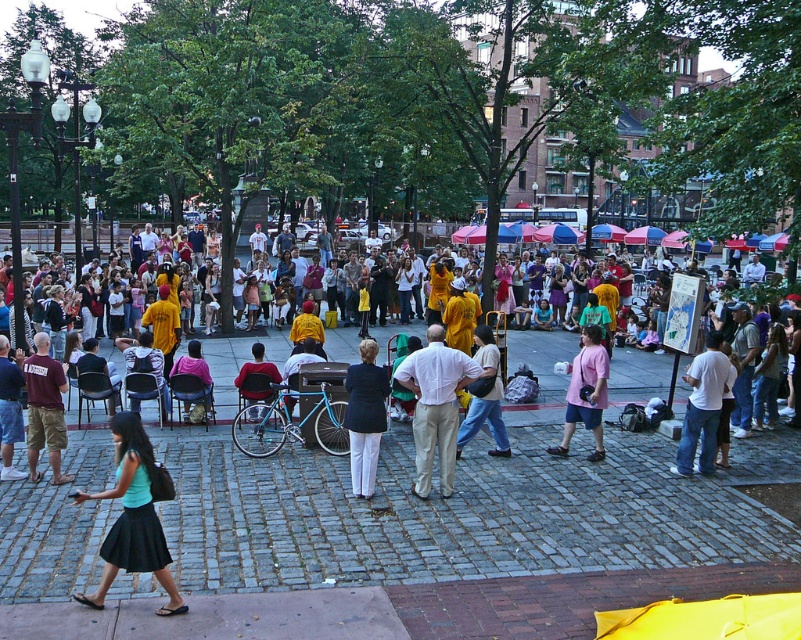
You are a photographer standing at the edge of the crowd, wanting to capture both the pink cotton shirt at center and the matte yellow shirt at center in a single frame. Your camera has a maximum focus range of 4 meters. Can you include both subjects in your shot without moving closer?

The distance between the pink cotton shirt at center and the matte yellow shirt at center is 3.95 meters. Since your camera can focus up to 4 meters, you can capture both subjects in one frame without moving closer.

You are standing in the public square and want to take a photo of the point marked at coordinates point (143, 554). If your camera has a maximum focus range of 20 feet, will you be able to capture it clearly?

The point (143, 554) is 23.29 feet away from the camera, which exceeds the maximum focus range of 20 feet. Therefore, the camera cannot capture it clearly.